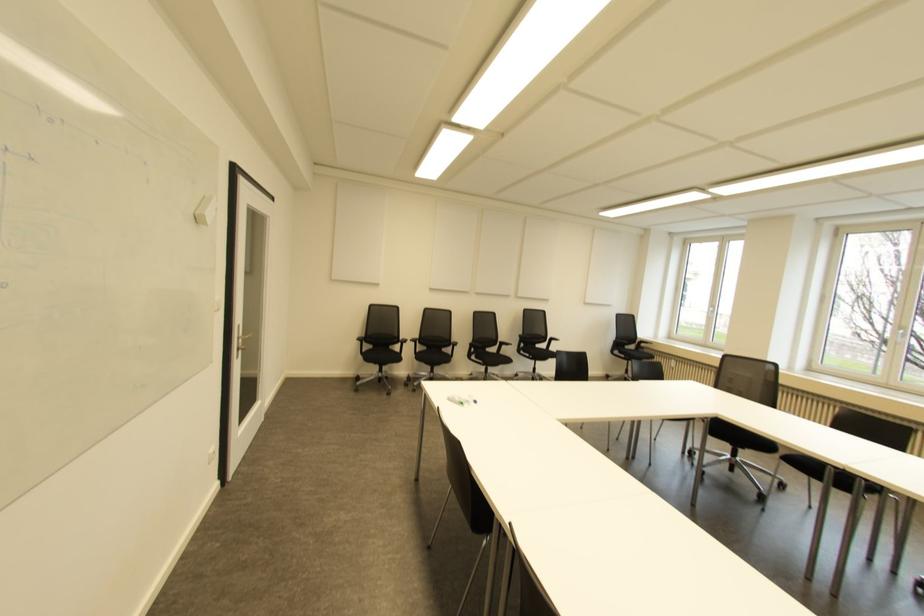
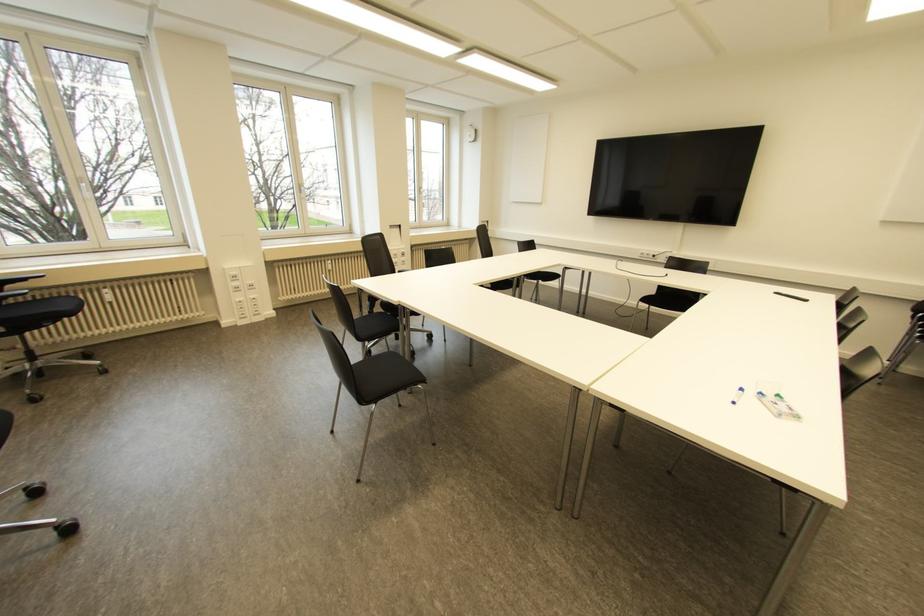
The point at (475,400) is marked in the first image. Where is the corresponding point in the second image?

(739, 390)